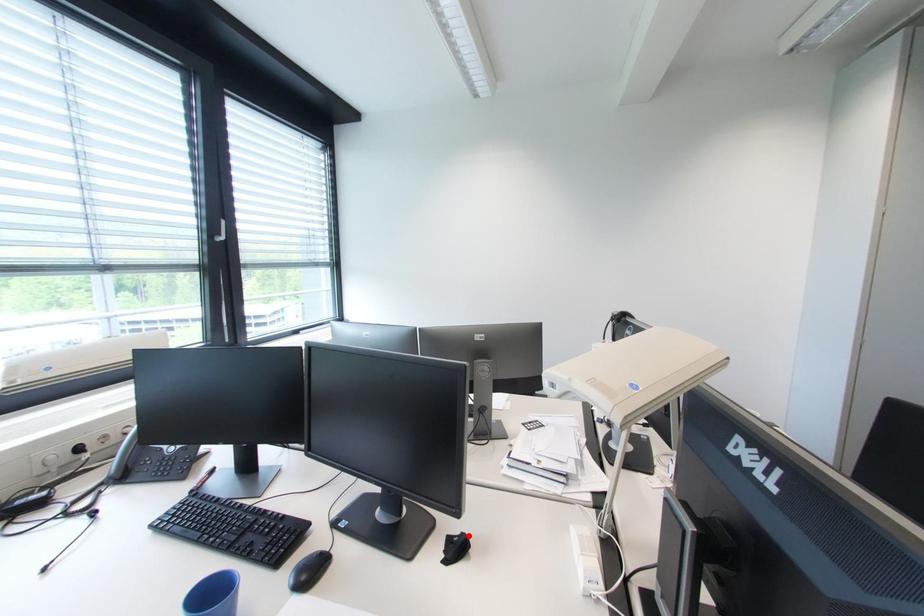
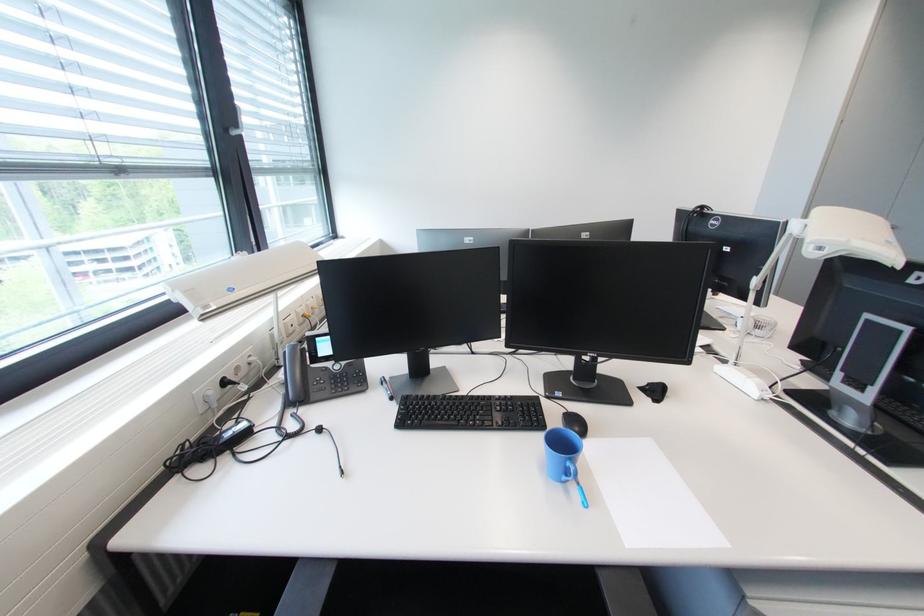
Find the pixel in the second image that matches the highlighted location in the first image.

(655, 386)